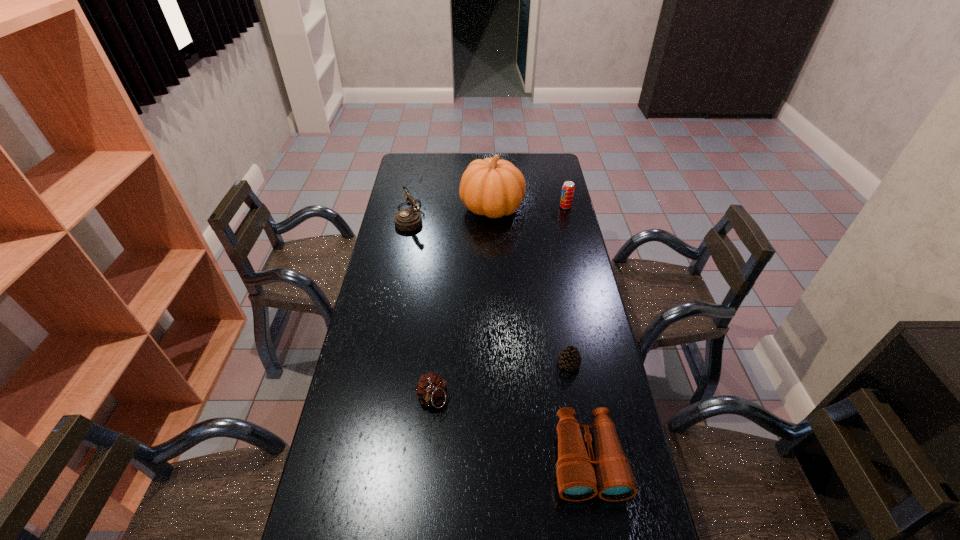
This screenshot has height=540, width=960. I want to click on free location located 0.230m on the back of the soda can, so click(x=559, y=177).

The image size is (960, 540). Identify the location of free region located with a leaf charm attached to the second object from left to right. pyautogui.click(x=428, y=440).

In order to click on vacant area situated through the lenses of the nearest object in this screenshot , I will do `click(601, 537)`.

This screenshot has height=540, width=960. I want to click on vacant space located at the narrow end of the farther pinecone, so click(463, 363).

At what (x,y) coordinates should I click in order to perform the action: click on vacant area situated at the narrow end of the farther pinecone. Please return your answer as a coordinate pair (x, y). Looking at the image, I should click on (522, 363).

Locate an element on the screen. free region located 0.350m at the narrow end of the farther pinecone is located at coordinates (447, 363).

Where is `object that is at the left edge`? The image size is (960, 540). object that is at the left edge is located at coordinates (409, 219).

In order to click on soda can present at the right edge in this screenshot , I will do `click(568, 187)`.

Where is `binoculars that is at the right edge`? binoculars that is at the right edge is located at coordinates (610, 475).

Find the location of `pinecone positioned at the right edge`. pinecone positioned at the right edge is located at coordinates (569, 358).